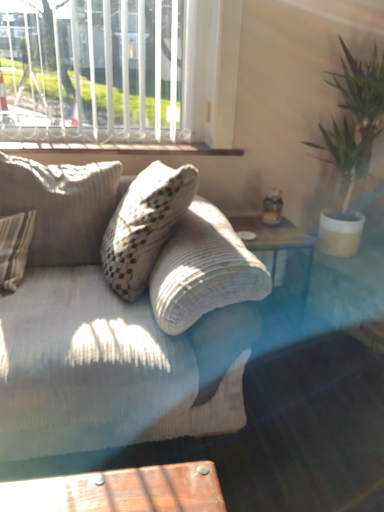
Question: Is green leafy plant at right facing towards textured beige pillow at left?

Choices:
 (A) no
 (B) yes

Answer: (A)

Question: From a real-world perspective, is green leafy plant at right positioned over textured beige pillow at left based on gravity?

Choices:
 (A) no
 (B) yes

Answer: (B)

Question: Is textured beige pillow at left completely or partially inside green leafy plant at right?

Choices:
 (A) no
 (B) yes

Answer: (A)

Question: From the image's perspective, does green leafy plant at right appear higher than textured beige pillow at left?

Choices:
 (A) yes
 (B) no

Answer: (A)

Question: Can you confirm if green leafy plant at right is thinner than textured beige pillow at left?

Choices:
 (A) no
 (B) yes

Answer: (A)

Question: From a real-world perspective, is green leafy plant at right physically below textured beige pillow at left?

Choices:
 (A) yes
 (B) no

Answer: (B)

Question: Can you see textured beige pillow at left touching white painted wood at upper center?

Choices:
 (A) yes
 (B) no

Answer: (B)

Question: Does textured beige pillow at left appear on the right side of white painted wood at upper center?

Choices:
 (A) no
 (B) yes

Answer: (A)

Question: Can you confirm if textured beige pillow at left is smaller than white painted wood at upper center?

Choices:
 (A) yes
 (B) no

Answer: (B)

Question: Are textured beige pillow at left and white painted wood at upper center located far from each other?

Choices:
 (A) yes
 (B) no

Answer: (B)

Question: Can you confirm if textured beige pillow at left is taller than white painted wood at upper center?

Choices:
 (A) no
 (B) yes

Answer: (B)

Question: Is textured beige pillow at left not within white painted wood at upper center?

Choices:
 (A) no
 (B) yes

Answer: (B)

Question: Considering the relative sizes of transparent glass plate at upper right and textured beige pillow at left in the image provided, is transparent glass plate at upper right thinner than textured beige pillow at left?

Choices:
 (A) yes
 (B) no

Answer: (A)